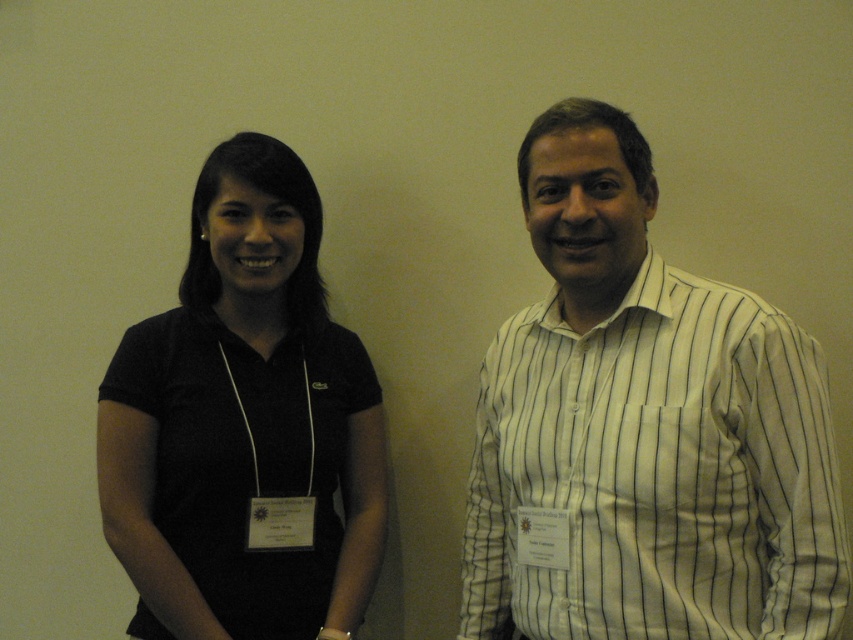
Who is taller, white striped shirt at right or black fabric shirt at left?

Standing taller between the two is black fabric shirt at left.

Between white striped shirt at right and black fabric shirt at left, which one is positioned higher?

white striped shirt at right

The height and width of the screenshot is (640, 853). I want to click on white striped shirt at right, so click(643, 429).